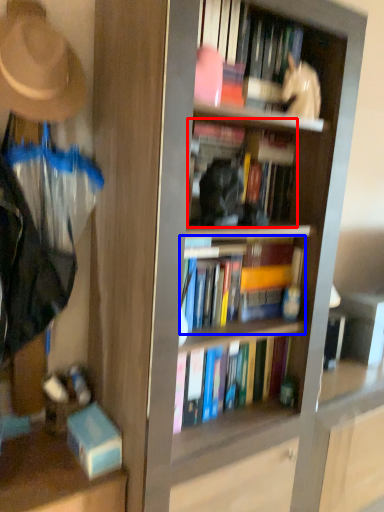
Question: Which object is closer to the camera taking this photo, book (highlighted by a red box) or book (highlighted by a blue box)?

Choices:
 (A) book
 (B) book

Answer: (A)